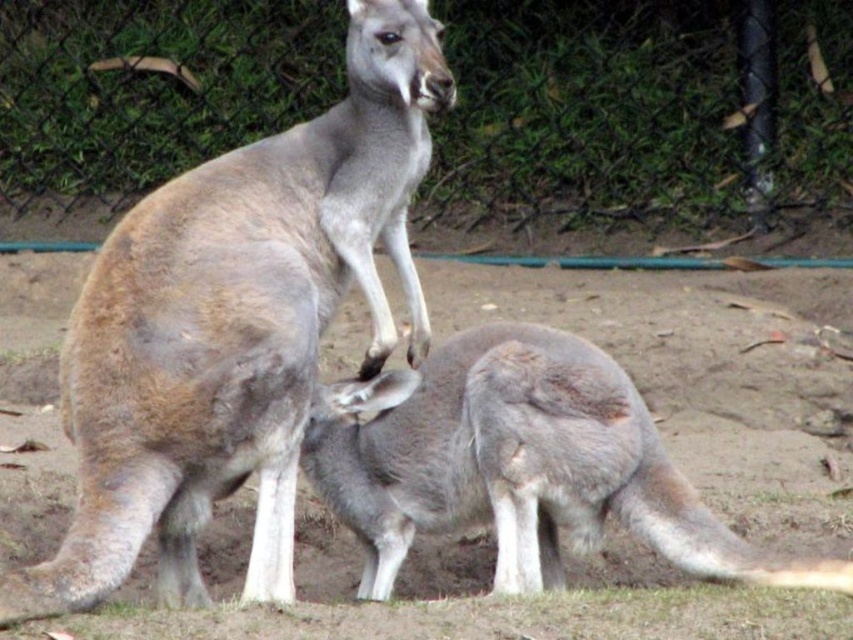
You are a zookeeper standing 3 meters away from the camera. You need to approach the gray fur kangaroo at center to feed it. Can you reach it without moving closer than your current position?

The gray fur kangaroo at center is 2.73 meters away from the camera. Since you are standing 3 meters away from the camera, you are 0.27 meters farther than the kangaroo. Therefore, you can reach it without moving closer than your current position.

You are a zookeeper trying to identify the older kangaroo between the gray fur kangaroo at center and the gray fur kangaroo at lower center. Based on their sizes, which one is more likely to be the older one?

The gray fur kangaroo at center is larger in size compared to the gray fur kangaroo at lower center. Since kangaroos typically grow larger with age, the gray fur kangaroo at center is more likely to be the older one.

You are a zookeeper observing two gray fur kangaroos in their enclosure. You notice the gray fur kangaroo at center and the gray fur kangaroo at lower center. Which one is positioned to the left of the other?

The gray fur kangaroo at center is to the left of the gray fur kangaroo at lower center.